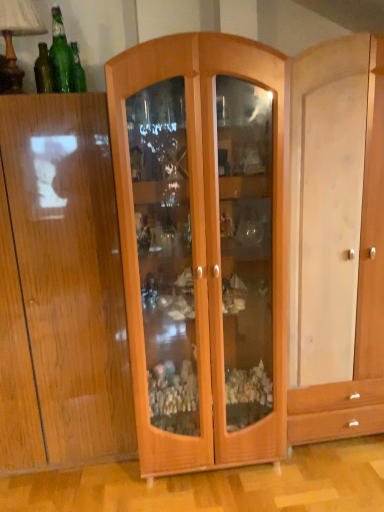
Describe the element at coordinates (61, 56) in the screenshot. The width and height of the screenshot is (384, 512). I see `green glass bottles at upper left` at that location.

Find the location of a particular element. The width and height of the screenshot is (384, 512). green glass bottles at upper left is located at coordinates (61, 56).

Identify the location of green glass bottles at upper left. (61, 56).